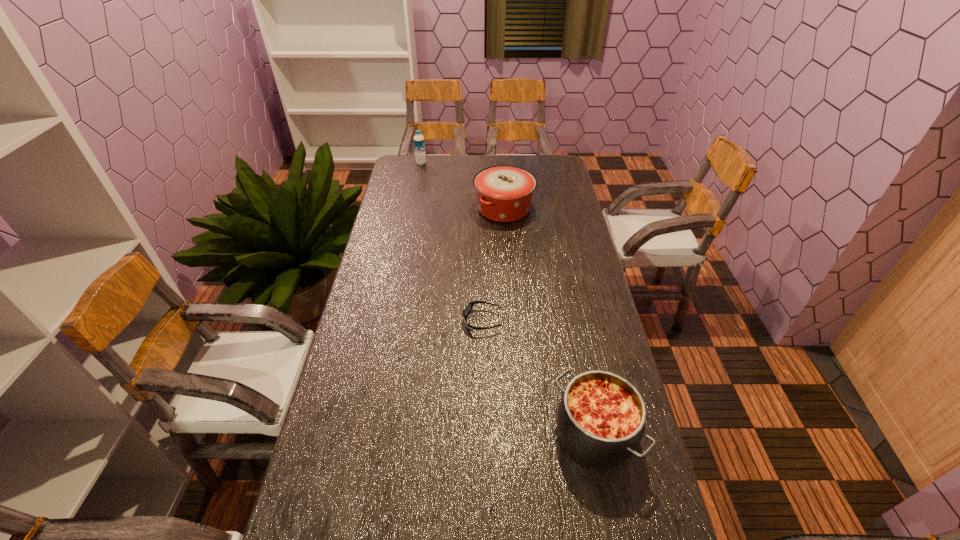
Image resolution: width=960 pixels, height=540 pixels. I want to click on vacant space located on the lenses of the sunglasses, so click(438, 321).

Identify the location of vacant space located 0.110m on the lenses of the sunglasses. The image size is (960, 540). (428, 321).

The image size is (960, 540). What are the coordinates of `free space located 0.190m on the lenses of the sunglasses` in the screenshot? It's located at (403, 321).

This screenshot has height=540, width=960. Find the location of `object present at the far edge`. object present at the far edge is located at coordinates click(x=419, y=144).

Find the location of a particular element. This screenshot has height=540, width=960. object that is at the left edge is located at coordinates (419, 144).

Find the location of a particular element. This screenshot has width=960, height=540. object situated at the right edge is located at coordinates (601, 416).

I want to click on object positioned at the far left corner, so [x=419, y=144].

The height and width of the screenshot is (540, 960). In order to click on vacant area at the left edge of the desktop in this screenshot , I will do `click(350, 322)`.

The width and height of the screenshot is (960, 540). In order to click on blank area at the right edge in this screenshot , I will do `click(579, 226)`.

This screenshot has width=960, height=540. Find the location of `free space at the far left corner of the desktop`. free space at the far left corner of the desktop is located at coordinates (408, 161).